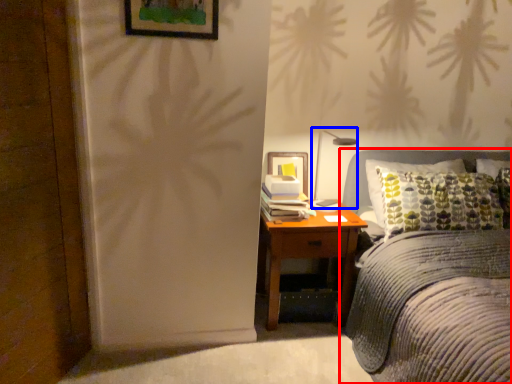
Question: Which object is further to the camera taking this photo, bed (highlighted by a red box) or bedside lamp (highlighted by a blue box)?

Choices:
 (A) bed
 (B) bedside lamp

Answer: (B)